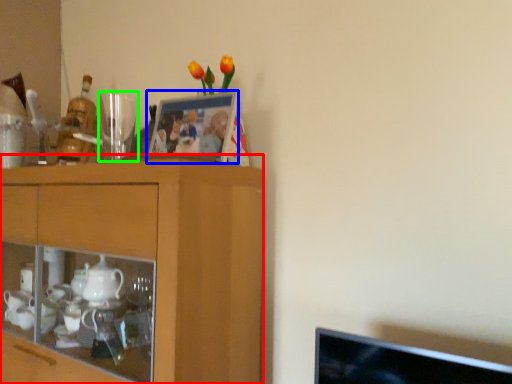
Question: Based on their relative distances, which object is nearer to cabinetry (highlighted by a red box)? Choose from picture frame (highlighted by a blue box) and tableware (highlighted by a green box).

Choices:
 (A) picture frame
 (B) tableware

Answer: (A)